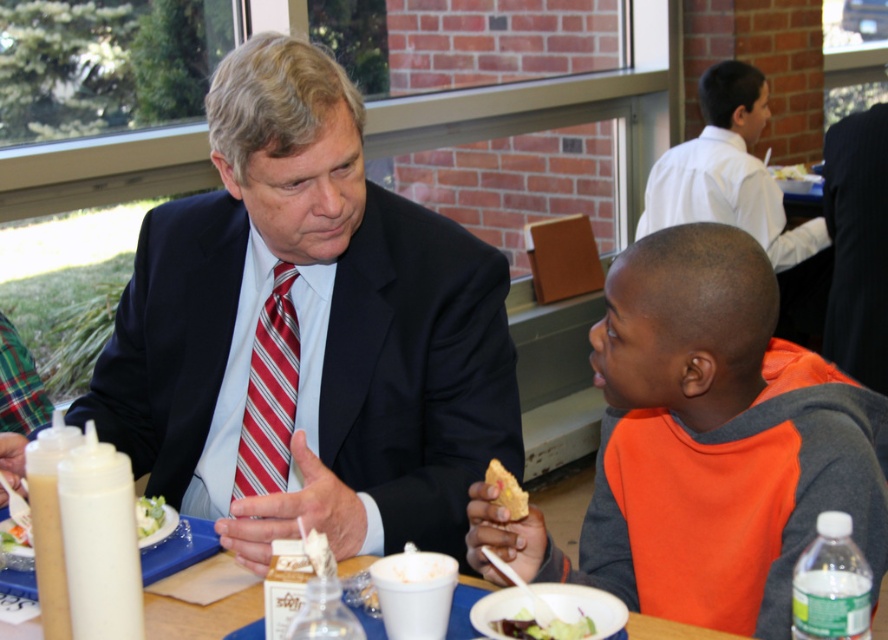
You are a fashion designer who needs to create a matching accessory for the orange fleece jacket at lower right and the red striped tie at center. Which object should you consider in terms of size when designing the accessory?

The orange fleece jacket at lower right is bigger than the red striped tie at center, so you should consider the size of the orange fleece jacket at lower right to ensure the accessory matches appropriately.

You are a photographer trying to capture a candid shot of the man and the boy. To avoid blocking the view of the red striped tie at center, where should you position yourself relative to the orange fleece jacket at lower right?

You should position yourself to the left of the orange fleece jacket at lower right because the orange fleece jacket at lower right is to the right of the red striped tie at center, so moving left would keep the jacket out of the way and allow a clear view of the tie.

You are a photographer trying to capture a closeup of the yellow crumbly bread at lower center without including the dark blue suit at right in the frame. Given their sizes, do you think this is possible?

The dark blue suit at right is bigger than the yellow crumbly bread at lower center, so it might be challenging to exclude the dark blue suit at right from the frame due to its larger size taking up more space.